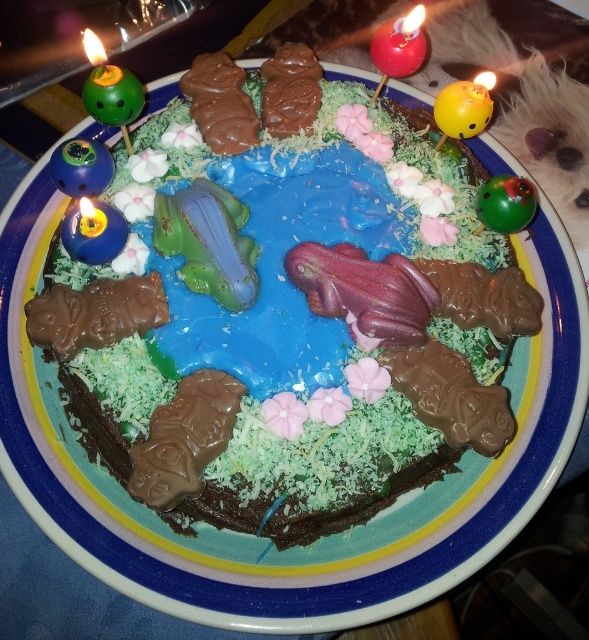
Which of these two, chocolate cake at center or green matte candle at upper left, stands shorter?

With less height is green matte candle at upper left.

Can you confirm if chocolate cake at center is taller than green matte candle at upper left?

Yes, chocolate cake at center is taller than green matte candle at upper left.

This screenshot has height=640, width=589. Describe the element at coordinates (283, 321) in the screenshot. I see `chocolate cake at center` at that location.

This screenshot has width=589, height=640. I want to click on chocolate cake at center, so click(x=283, y=321).

Is point (75, 307) in front of point (416, 10)?

Yes, it is.

Measure the distance between chocolate cake at center and shiny red candle at upper center.

chocolate cake at center is 45.50 centimeters from shiny red candle at upper center.

Image resolution: width=589 pixels, height=640 pixels. Describe the element at coordinates (283, 321) in the screenshot. I see `chocolate cake at center` at that location.

I want to click on chocolate cake at center, so click(283, 321).

Who is more distant from viewer, (x=90, y=83) or (x=382, y=81)?

The point (x=382, y=81) is more distant.

Is green matte candle at upper left smaller than shiny red candle at upper center?

Indeed, green matte candle at upper left has a smaller size compared to shiny red candle at upper center.

Is point (138, 104) positioned after point (405, 26)?

No, it is not.

At what (x,y) coordinates should I click in order to perform the action: click on green matte candle at upper left. Please return your answer as a coordinate pair (x, y). Looking at the image, I should click on (110, 90).